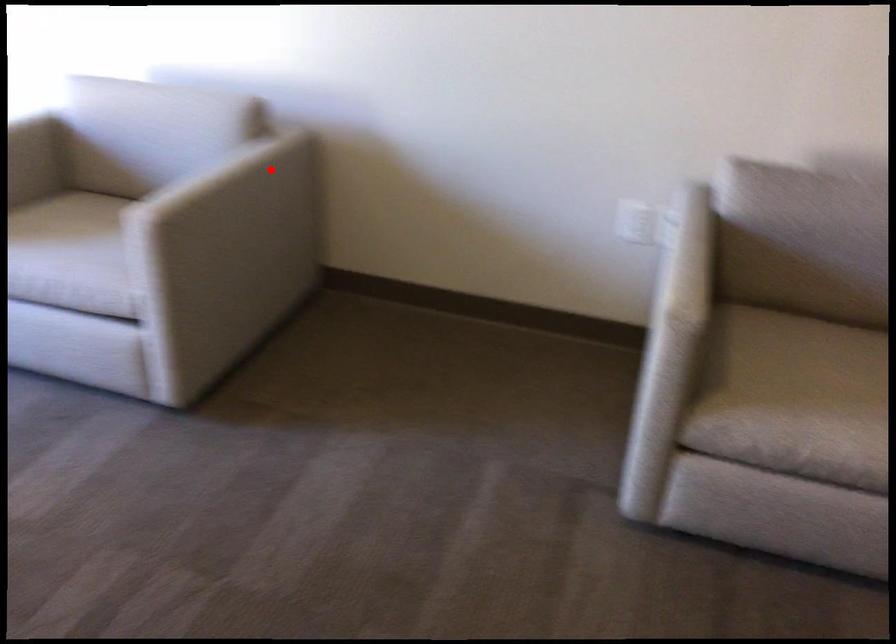
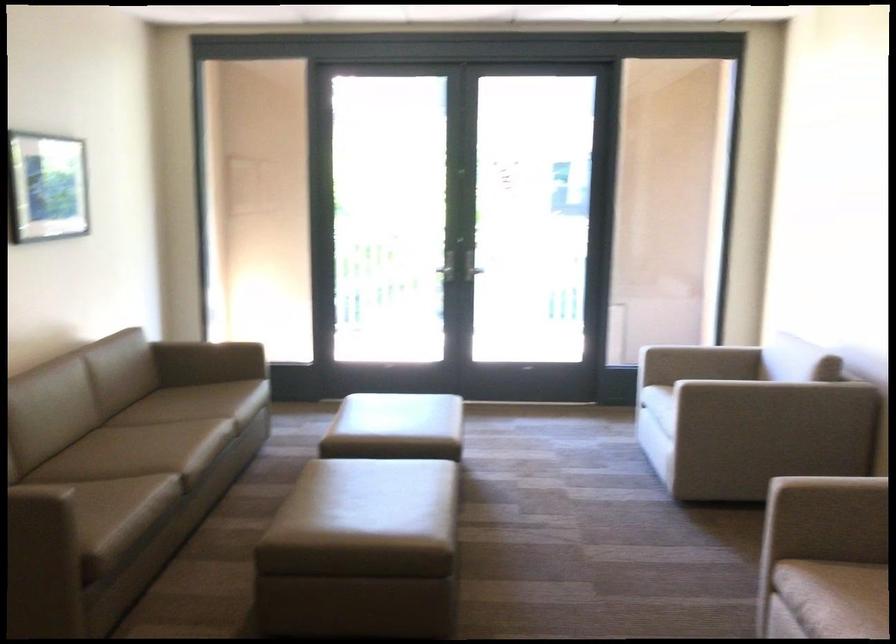
Locate, in the second image, the point that corresponds to the highlighted location in the first image.

(774, 392)